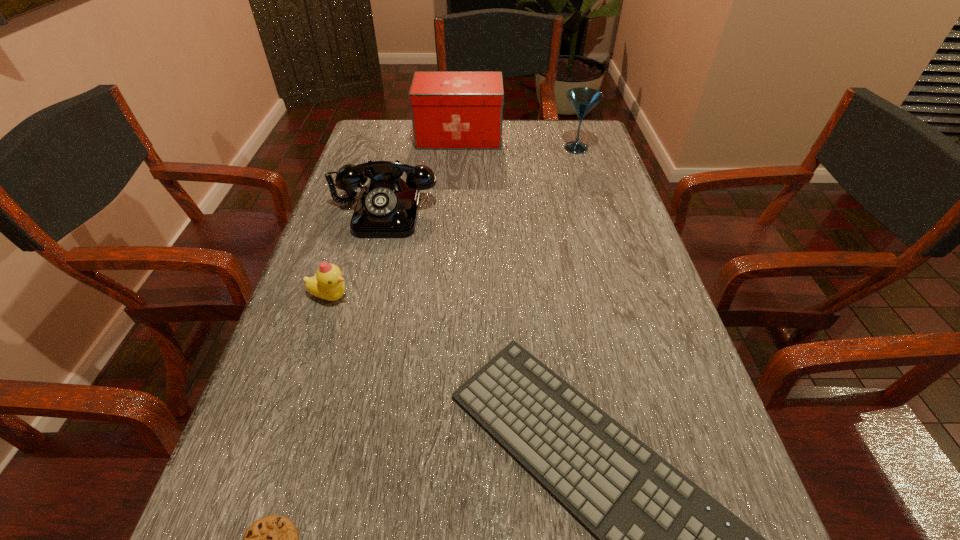
Where is `the first-aid kit situated at the far edge`? The height and width of the screenshot is (540, 960). the first-aid kit situated at the far edge is located at coordinates [450, 110].

This screenshot has width=960, height=540. Identify the location of martini positioned at the far edge. (583, 100).

The width and height of the screenshot is (960, 540). I want to click on telephone positioned at the left edge, so click(387, 207).

Identify the location of duckling that is at the left edge. This screenshot has height=540, width=960. (327, 284).

This screenshot has height=540, width=960. In order to click on object that is at the right edge in this screenshot , I will do `click(583, 100)`.

The image size is (960, 540). I want to click on object present at the far right corner, so click(583, 100).

Image resolution: width=960 pixels, height=540 pixels. Find the location of `free region at the far edge of the desktop`. free region at the far edge of the desktop is located at coordinates (471, 157).

Identify the location of free region at the left edge. (239, 505).

Where is `vacant space at the right edge of the desktop`? The width and height of the screenshot is (960, 540). vacant space at the right edge of the desktop is located at coordinates (670, 328).

Image resolution: width=960 pixels, height=540 pixels. Find the location of `free space at the far left corner of the desktop`. free space at the far left corner of the desktop is located at coordinates (380, 132).